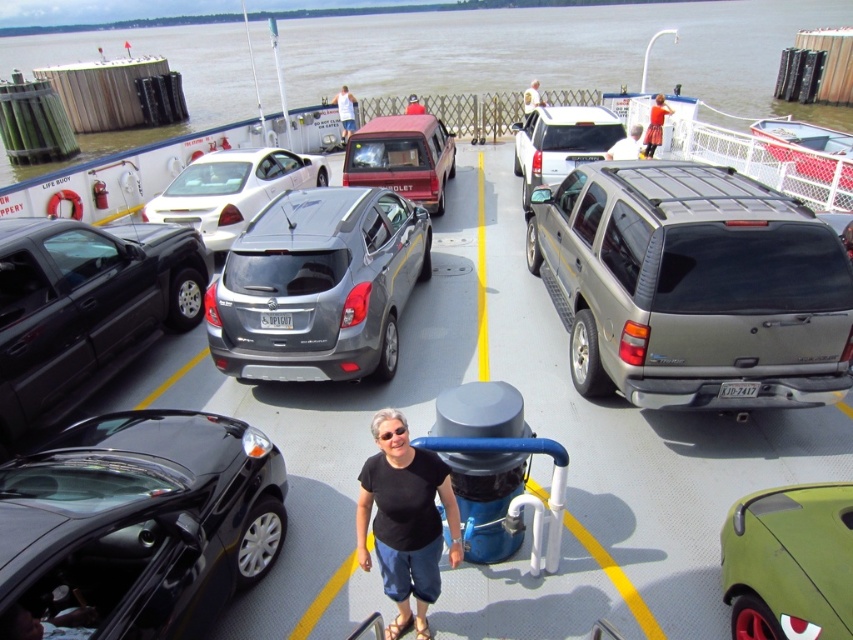
Who is more distant from viewer, (234, 502) or (409, 97)?

The point (409, 97) is behind.

Locate an element on the screen. The image size is (853, 640). shiny black car at lower left is located at coordinates (137, 525).

Who is taller, white fabric shirt at center or light blue shirt at center?

Answer: light blue shirt at center

This screenshot has height=640, width=853. I want to click on white fabric shirt at center, so click(x=625, y=145).

This screenshot has height=640, width=853. I want to click on white fabric shirt at center, so click(x=625, y=145).

Measure the distance between satin silver sedan at center and matte red minivan at center.

satin silver sedan at center and matte red minivan at center are 7.38 feet apart.

Measure the distance between satin silver sedan at center and matte red minivan at center.

satin silver sedan at center is 2.25 meters from matte red minivan at center.

Who is more distant from viewer, (183, 182) or (381, 129)?

Positioned behind is point (381, 129).

Locate an element on the screen. satin silver sedan at center is located at coordinates (231, 189).